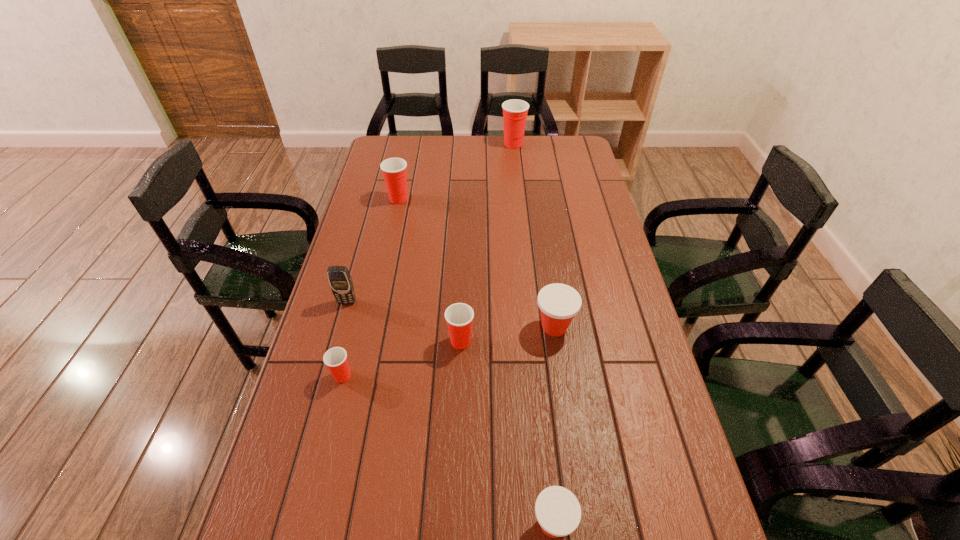
Locate an element on the screen. free space at the right edge is located at coordinates (574, 166).

This screenshot has height=540, width=960. Identify the location of vacant space at the far right corner of the desktop. (570, 156).

You are a GUI agent. You are given a task and a screenshot of the screen. Output one action in this format:
    pyautogui.click(x=<x>, y=<y>)
    Task: Click on the vacant space that's between the second smallest red Dixie cup and the bigger red-orange Dixie cup
    This screenshot has height=540, width=960.
    Given the screenshot: What is the action you would take?
    pyautogui.click(x=508, y=334)

What are the coordinates of `free space between the third farthest object and the farthest red Dixie cup` in the screenshot? It's located at (430, 223).

This screenshot has width=960, height=540. I want to click on vacant area that lies between the farthest red Dixie cup and the cellular telephone, so click(x=430, y=223).

Choose which object is the sixth nearest neighbor to the bigger red-orange Dixie cup. Please provide its 2D coordinates. Your answer should be formatted as a tuple, i.e. [(x, y)], where the tuple contains the x and y coordinates of a point satisfying the conditions above.

[(515, 111)]

This screenshot has height=540, width=960. Find the location of `object that is the fourth closest to the farther red-orange Dixie cup`. object that is the fourth closest to the farther red-orange Dixie cup is located at coordinates (340, 280).

Identify the location of Dixie cup identified as the third closest to the third farthest object. This screenshot has width=960, height=540. (394, 170).

Identify the location of the third closest Dixie cup relative to the second nearest Dixie cup. (558, 512).

Choose which red Dixie cup is the third nearest neighbor to the second farthest red Dixie cup. Please provide its 2D coordinates. Your answer should be formatted as a tuple, i.e. [(x, y)], where the tuple contains the x and y coordinates of a point satisfying the conditions above.

[(335, 358)]